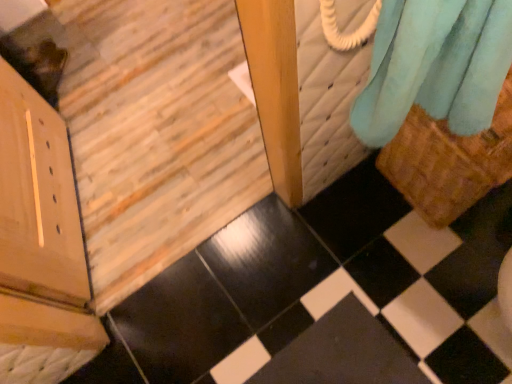
Question: Is black glossy tile at lower right to the left of soft blue fabric at upper right from the viewer's perspective?

Choices:
 (A) no
 (B) yes

Answer: (B)

Question: Considering the relative positions of black glossy tile at lower right and soft blue fabric at upper right in the image provided, is black glossy tile at lower right behind soft blue fabric at upper right?

Choices:
 (A) no
 (B) yes

Answer: (B)

Question: From the image's perspective, is black glossy tile at lower right located beneath soft blue fabric at upper right?

Choices:
 (A) no
 (B) yes

Answer: (B)

Question: From a real-world perspective, is black glossy tile at lower right positioned under soft blue fabric at upper right based on gravity?

Choices:
 (A) yes
 (B) no

Answer: (A)

Question: Can you confirm if black glossy tile at lower right is thinner than soft blue fabric at upper right?

Choices:
 (A) no
 (B) yes

Answer: (A)

Question: Is the position of black glossy tile at lower right less distant than that of soft blue fabric at upper right?

Choices:
 (A) no
 (B) yes

Answer: (A)

Question: From the image's perspective, is wooden door at lower left located beneath black glossy tile at lower right?

Choices:
 (A) yes
 (B) no

Answer: (B)

Question: Could you tell me if wooden door at lower left is turned towards black glossy tile at lower right?

Choices:
 (A) no
 (B) yes

Answer: (B)

Question: Is black glossy tile at lower right inside wooden door at lower left?

Choices:
 (A) yes
 (B) no

Answer: (B)

Question: Is wooden door at lower left located outside black glossy tile at lower right?

Choices:
 (A) yes
 (B) no

Answer: (A)

Question: Considering the relative positions of wooden door at lower left and black glossy tile at lower right in the image provided, is wooden door at lower left in front of black glossy tile at lower right?

Choices:
 (A) no
 (B) yes

Answer: (B)

Question: Is wooden door at lower left turned away from black glossy tile at lower right?

Choices:
 (A) yes
 (B) no

Answer: (B)

Question: Considering the relative positions of wooden door at lower left and soft blue fabric at upper right in the image provided, is wooden door at lower left to the right of soft blue fabric at upper right from the viewer's perspective?

Choices:
 (A) yes
 (B) no

Answer: (B)